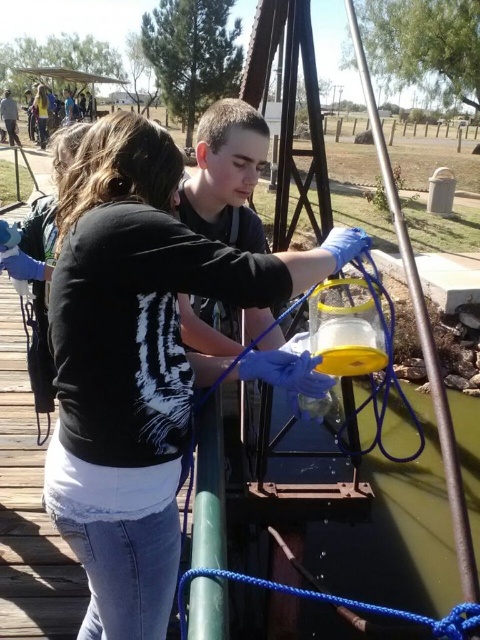
Question: Can you confirm if blue braided rope at lower center is positioned below black matte shirt at upper left?

Choices:
 (A) no
 (B) yes

Answer: (B)

Question: In this image, where is blue braided rope at lower center located relative to gray fabric shirt at upper left?

Choices:
 (A) left
 (B) right

Answer: (B)

Question: Which of the following is the closest to the observer?

Choices:
 (A) (170, 316)
 (B) (8, 104)

Answer: (A)

Question: Estimate the real-world distances between objects in this image. Which object is farther from the black matte shirt at upper left?

Choices:
 (A) matte black shirt at center
 (B) gray fabric shirt at upper left
 (C) blue braided rope at lower center

Answer: (C)

Question: Which of the following is the closest to the observer?

Choices:
 (A) gray fabric shirt at upper left
 (B) blue braided rope at lower center
 (C) black matte shirt at upper left

Answer: (B)

Question: Is matte black shirt at center positioned in front of black matte shirt at upper left?

Choices:
 (A) no
 (B) yes

Answer: (B)